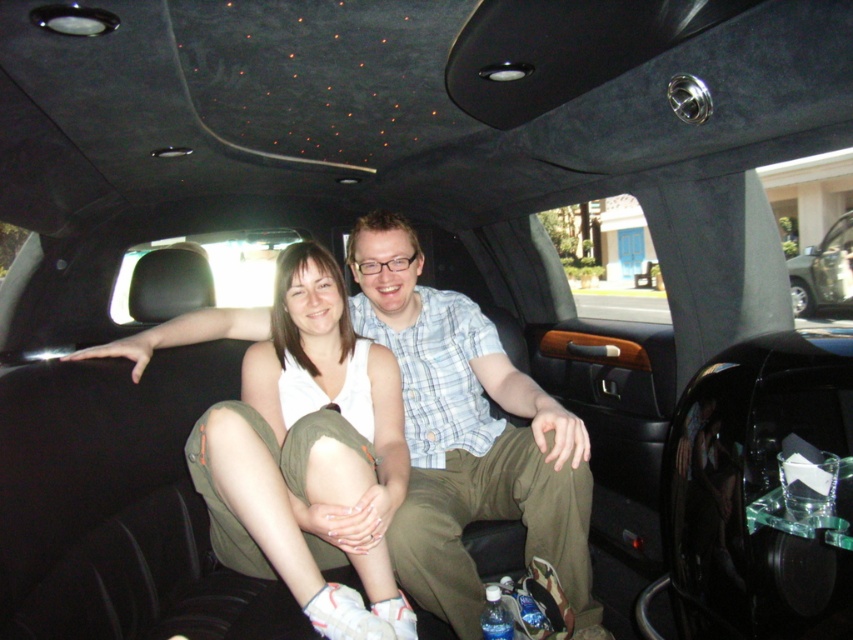
Question: Can you confirm if light blue plaid shirt at center is bigger than metallic silver car at center?

Choices:
 (A) yes
 (B) no

Answer: (B)

Question: Which point is closer to the camera taking this photo?

Choices:
 (A) (386, 604)
 (B) (476, 360)
 (C) (801, 266)
 (D) (538, 401)

Answer: (A)

Question: Among these objects, which one is farthest from the camera?

Choices:
 (A) metallic silver car at center
 (B) light blue plaid shirt at center
 (C) matte white tank top at center

Answer: (A)

Question: Is light blue plaid shirt at center in front of metallic silver car at center?

Choices:
 (A) yes
 (B) no

Answer: (A)

Question: Is matte white tank top at center closer to the viewer compared to light blue plaid shirt at center?

Choices:
 (A) no
 (B) yes

Answer: (B)

Question: Among these points, which one is farthest from the camera?

Choices:
 (A) (442, 548)
 (B) (277, 346)
 (C) (799, 278)

Answer: (C)